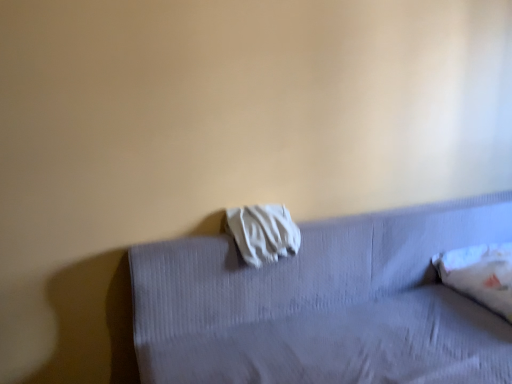
Question: Is white fabric at upper center positioned before white fabric at center?

Choices:
 (A) yes
 (B) no

Answer: (A)

Question: From the image's perspective, does white fabric at upper center appear lower than white fabric at center?

Choices:
 (A) no
 (B) yes

Answer: (B)

Question: Is white fabric at upper center at the left side of white fabric at center?

Choices:
 (A) no
 (B) yes

Answer: (A)

Question: Is white fabric at upper center outside white fabric at center?

Choices:
 (A) yes
 (B) no

Answer: (A)

Question: Does white fabric at upper center have a greater height compared to white fabric at center?

Choices:
 (A) yes
 (B) no

Answer: (A)

Question: Does white fabric at upper center have a smaller size compared to white fabric at center?

Choices:
 (A) yes
 (B) no

Answer: (B)

Question: Considering the relative sizes of white fabric at center and white fabric at upper center in the image provided, is white fabric at center wider than white fabric at upper center?

Choices:
 (A) no
 (B) yes

Answer: (A)

Question: Is the position of white fabric at center more distant than that of white fabric at upper center?

Choices:
 (A) no
 (B) yes

Answer: (B)

Question: Does white fabric at center have a greater height compared to white fabric at upper center?

Choices:
 (A) yes
 (B) no

Answer: (B)

Question: Does white fabric at center have a lesser height compared to white fabric at upper center?

Choices:
 (A) yes
 (B) no

Answer: (A)

Question: Is white fabric at center oriented towards white fabric at upper center?

Choices:
 (A) no
 (B) yes

Answer: (B)

Question: Is white fabric at center thinner than white fabric at upper center?

Choices:
 (A) no
 (B) yes

Answer: (B)

Question: Does white soft pillow at right have a smaller size compared to white fabric at upper center?

Choices:
 (A) no
 (B) yes

Answer: (B)